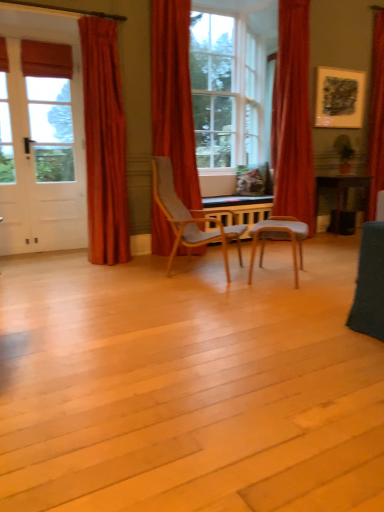
Identify the location of vacant point to the left of light gray fabric chair at center, placed as the first chair when sorted from left to right. (122, 275).